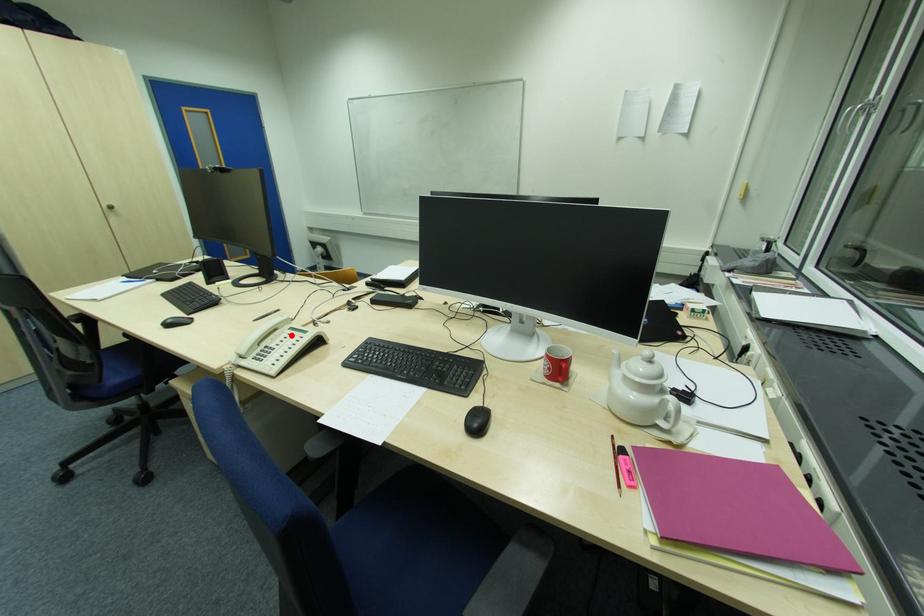
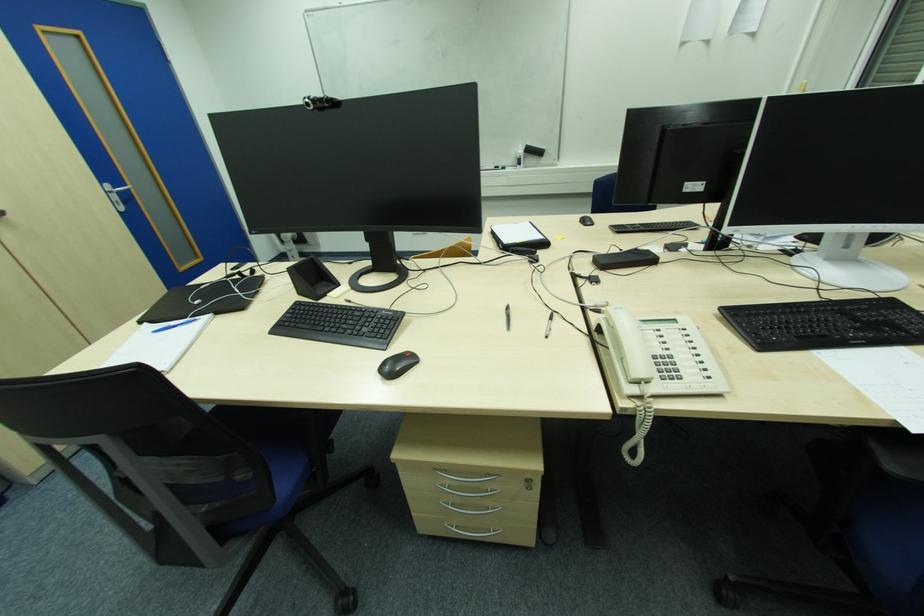
Where in the second image is the point corresponding to the highlighted location from the first image?

(661, 331)